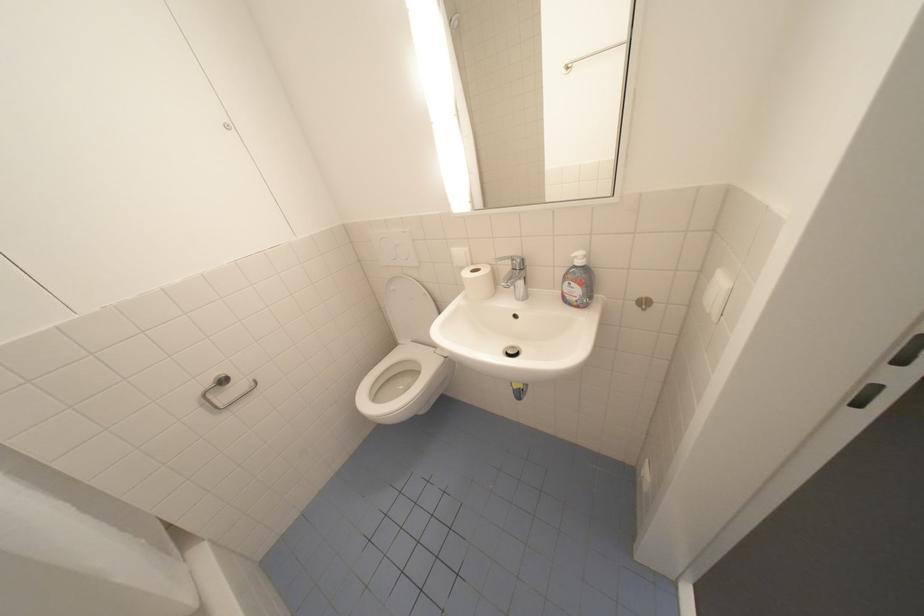
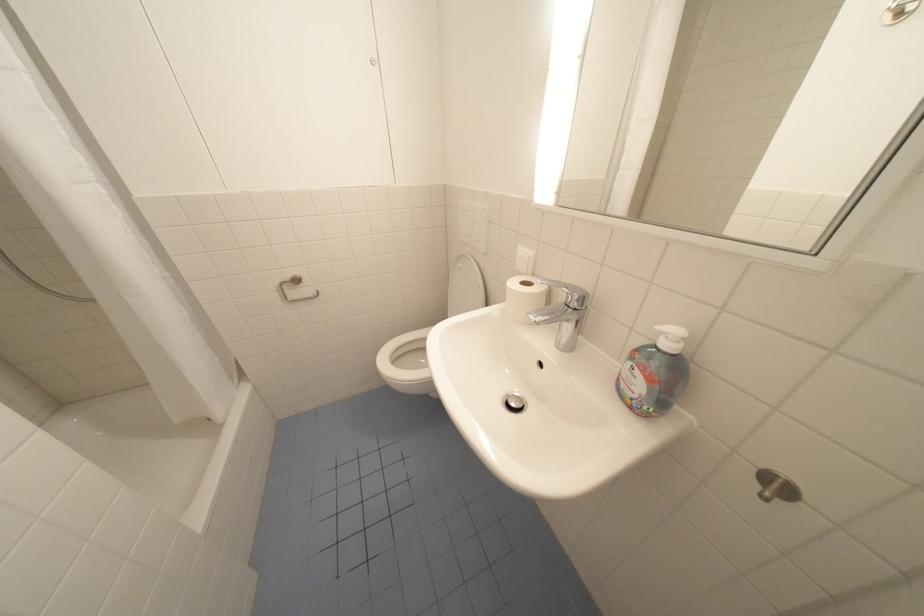
The point at (588,264) is marked in the first image. Where is the corresponding point in the second image?

(675, 347)